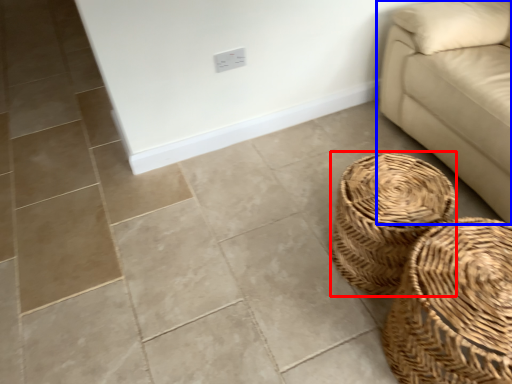
Question: Which object is further to the camera taking this photo, basket (highlighted by a red box) or studio couch (highlighted by a blue box)?

Choices:
 (A) basket
 (B) studio couch

Answer: (A)